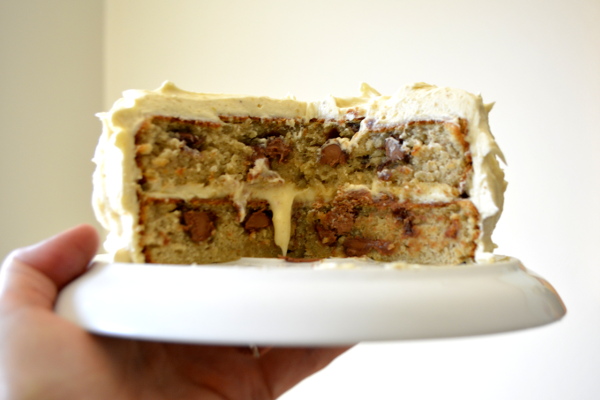
Find the location of a particular element. The height and width of the screenshot is (400, 600). walls is located at coordinates (305, 67), (65, 99).